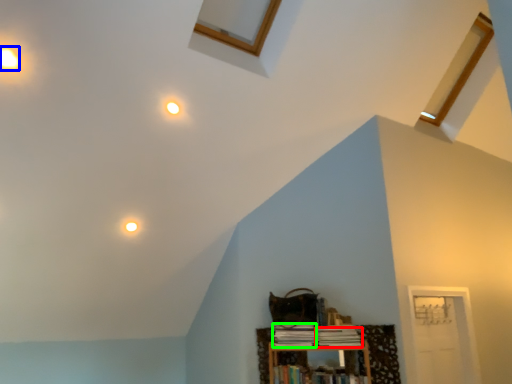
Question: Which object is the closest to the book (highlighted by a red box)? Choose among these: dot (highlighted by a blue box) or book (highlighted by a green box).

Choices:
 (A) dot
 (B) book

Answer: (B)